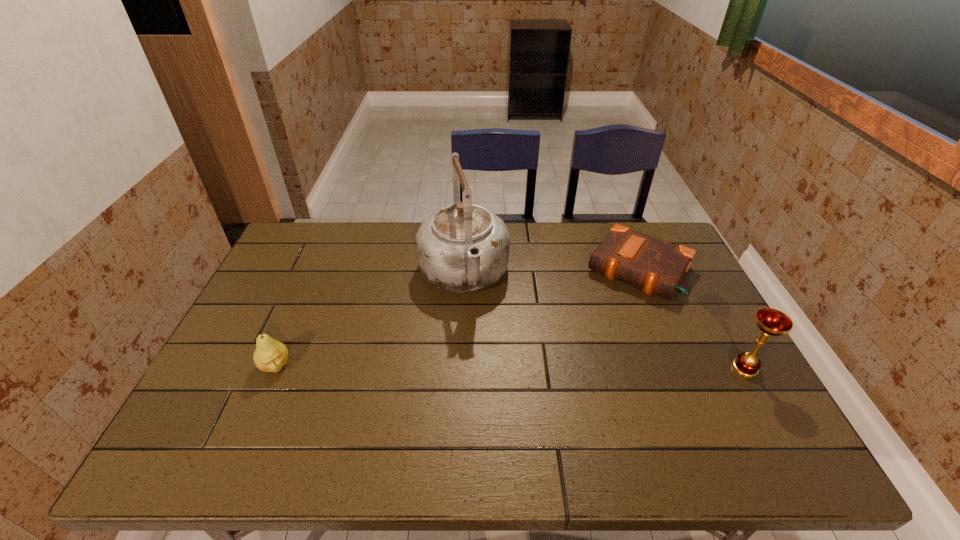
Where is `free spot on the desktop that is between the leftmost object and the second tallest object and is positioned at the spout of the kettle`? The width and height of the screenshot is (960, 540). free spot on the desktop that is between the leftmost object and the second tallest object and is positioned at the spout of the kettle is located at coordinates (488, 367).

Locate an element on the screen. free space on the desktop that is between the third tallest object and the third shortest object and is positioned on the spine side of the Bible is located at coordinates (574, 367).